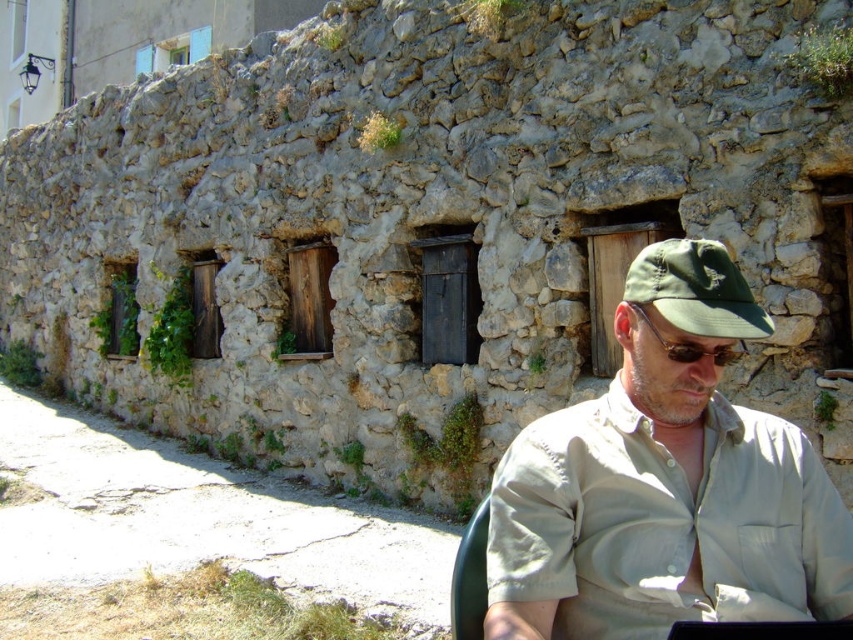
Is point (506, 572) farther from viewer compared to point (751, 330)?

That is True.

Between khaki cotton shirt at center and green fabric cap at center, which one has less height?

Standing shorter between the two is green fabric cap at center.

The image size is (853, 640). In order to click on khaki cotton shirt at center in this screenshot , I will do `click(665, 483)`.